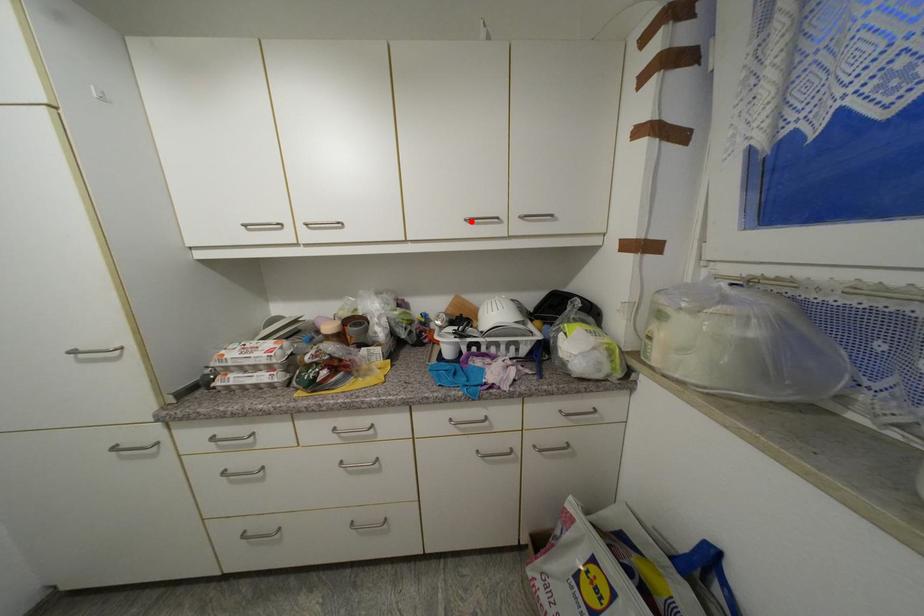
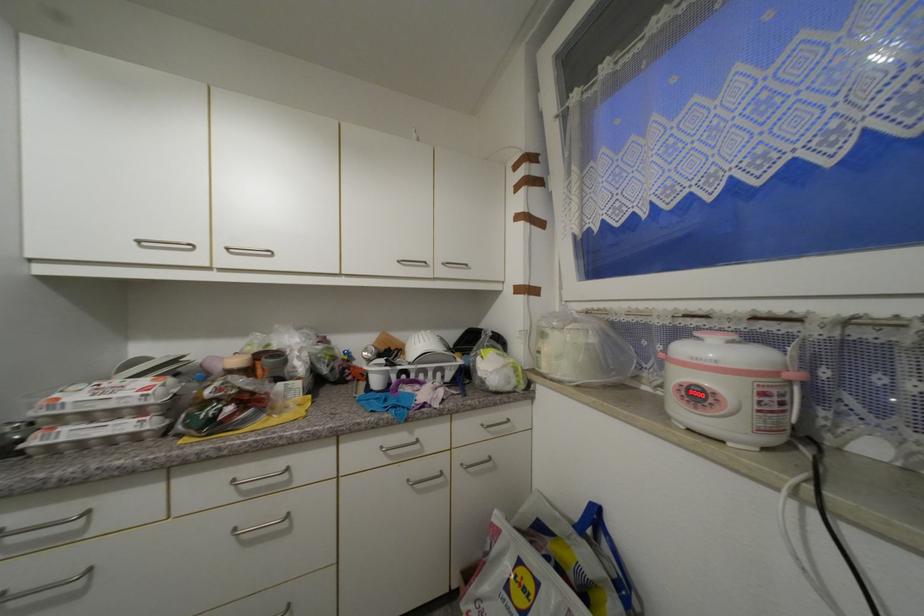
Find the pixel in the second image that matches the highlighted location in the first image.

(405, 262)